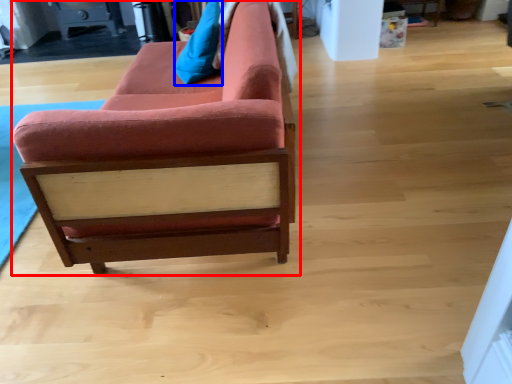
Question: Which object appears farthest to the camera in this image, studio couch (highlighted by a red box) or pillow (highlighted by a blue box)?

Choices:
 (A) studio couch
 (B) pillow

Answer: (B)